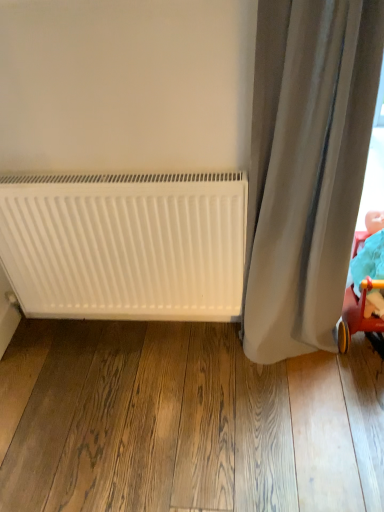
At what (x,y) coordinates should I click in order to perform the action: click on matte red plastic baby carriage at lower right. Please return your answer as a coordinate pair (x, y). Looking at the image, I should click on (357, 314).

Considering the positions of objects gray fabric curtain at right and matte red plastic baby carriage at lower right in the image provided, who is behind, gray fabric curtain at right or matte red plastic baby carriage at lower right?

matte red plastic baby carriage at lower right is further from the camera.

Which point is more distant from viewer, (287, 137) or (341, 348)?

Positioned behind is point (341, 348).

Identify the location of baby carriage behind the gray fabric curtain at right. (357, 314).

Considering the positions of objects gray fabric curtain at right and matte red plastic baby carriage at lower right in the image provided, who is more to the right, gray fabric curtain at right or matte red plastic baby carriage at lower right?

matte red plastic baby carriage at lower right is more to the right.

Which is behind, point (363, 234) or point (269, 37)?

The point (363, 234) is more distant.

Considering the positions of objects matte red plastic baby carriage at lower right and gray fabric curtain at right in the image provided, who is more to the left, matte red plastic baby carriage at lower right or gray fabric curtain at right?

Positioned to the left is gray fabric curtain at right.

Can we say matte red plastic baby carriage at lower right lies outside gray fabric curtain at right?

Yes.

Which is in front, matte red plastic baby carriage at lower right or gray fabric curtain at right?

gray fabric curtain at right.

Which object is wider, white matte radiator at lower left or gray fabric curtain at right?

Wider between the two is gray fabric curtain at right.

In the image, is white matte radiator at lower left on the left side or the right side of gray fabric curtain at right?

white matte radiator at lower left is positioned on gray fabric curtain at right's left side.

Which point is more distant from viewer, (x=90, y=241) or (x=272, y=280)?

The point (x=90, y=241) is more distant.

Find the location of `radiator below the gray fabric curtain at right (from a real-world perspective)`. radiator below the gray fabric curtain at right (from a real-world perspective) is located at coordinates (125, 244).

Is matte red plastic baby carriage at lower right in front of white matte radiator at lower left?

Yes.

This screenshot has height=512, width=384. In order to click on radiator that is on the left side of matte red plastic baby carriage at lower right in this screenshot , I will do `click(125, 244)`.

From the image's perspective, does matte red plastic baby carriage at lower right appear higher than white matte radiator at lower left?

Actually, matte red plastic baby carriage at lower right appears below white matte radiator at lower left in the image.

Which object is positioned more to the right, white matte radiator at lower left or matte red plastic baby carriage at lower right?

Positioned to the right is matte red plastic baby carriage at lower right.

Considering their positions, is white matte radiator at lower left located in front of or behind matte red plastic baby carriage at lower right?

white matte radiator at lower left is positioned farther from the viewer than matte red plastic baby carriage at lower right.

Is white matte radiator at lower left looking in the opposite direction of matte red plastic baby carriage at lower right?

No, white matte radiator at lower left is not facing the opposite direction of matte red plastic baby carriage at lower right.

From a real-world perspective, is white matte radiator at lower left below matte red plastic baby carriage at lower right?

No, from a real-world perspective, white matte radiator at lower left is not under matte red plastic baby carriage at lower right.

From the image's perspective, is gray fabric curtain at right on white matte radiator at lower left?

Yes.

Which is in front, gray fabric curtain at right or white matte radiator at lower left?

gray fabric curtain at right is more forward.

Does gray fabric curtain at right have a greater height compared to white matte radiator at lower left?

Yes.

How many degrees apart are the facing directions of gray fabric curtain at right and white matte radiator at lower left?

There is a 0.0734-degree angle between the facing directions of gray fabric curtain at right and white matte radiator at lower left.

Where is `baby carriage that is on the right side of gray fabric curtain at right`? This screenshot has width=384, height=512. baby carriage that is on the right side of gray fabric curtain at right is located at coordinates (357, 314).

This screenshot has height=512, width=384. Find the location of `baby carriage below the gray fabric curtain at right (from the image's perspective)`. baby carriage below the gray fabric curtain at right (from the image's perspective) is located at coordinates (357, 314).

Based on their spatial positions, is matte red plastic baby carriage at lower right or white matte radiator at lower left further from gray fabric curtain at right?

white matte radiator at lower left is positioned further to the anchor gray fabric curtain at right.

Considering their positions, is white matte radiator at lower left positioned further to matte red plastic baby carriage at lower right than gray fabric curtain at right?

Among the two, white matte radiator at lower left is located further to matte red plastic baby carriage at lower right.

Looking at the image, which one is located further to matte red plastic baby carriage at lower right, gray fabric curtain at right or white matte radiator at lower left?

Based on the image, white matte radiator at lower left appears to be further to matte red plastic baby carriage at lower right.

Considering their positions, is matte red plastic baby carriage at lower right positioned closer to white matte radiator at lower left than gray fabric curtain at right?

gray fabric curtain at right is closer to white matte radiator at lower left.

Looking at the image, which one is located closer to gray fabric curtain at right, white matte radiator at lower left or matte red plastic baby carriage at lower right?

matte red plastic baby carriage at lower right is closer to gray fabric curtain at right.

Considering their positions, is gray fabric curtain at right positioned closer to white matte radiator at lower left than matte red plastic baby carriage at lower right?

gray fabric curtain at right is positioned closer to the anchor white matte radiator at lower left.

Where is `curtain between white matte radiator at lower left and matte red plastic baby carriage at lower right from left to right`? curtain between white matte radiator at lower left and matte red plastic baby carriage at lower right from left to right is located at coordinates (306, 168).